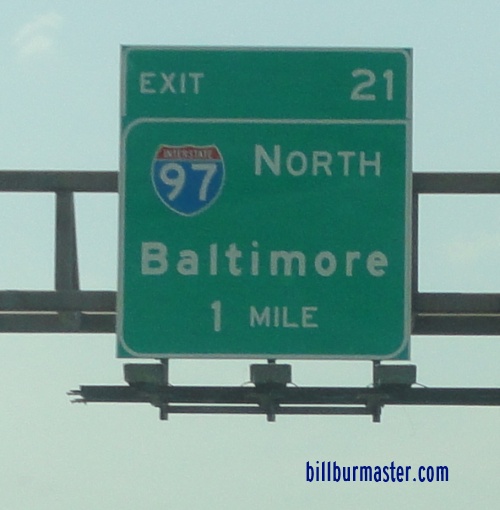
Identify the location of lights. (285, 375).